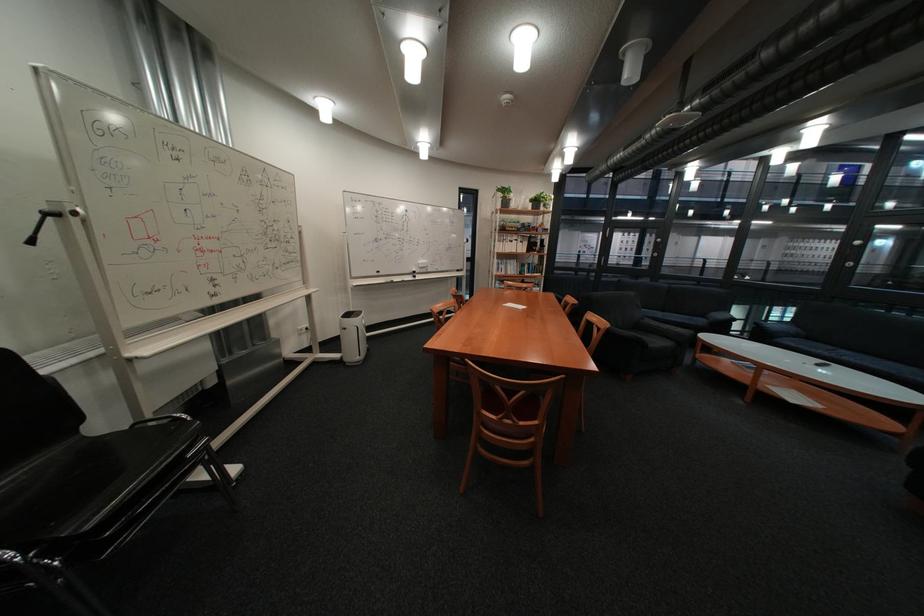
Where is `dark sofa armrest`? dark sofa armrest is located at coordinates (602, 326).